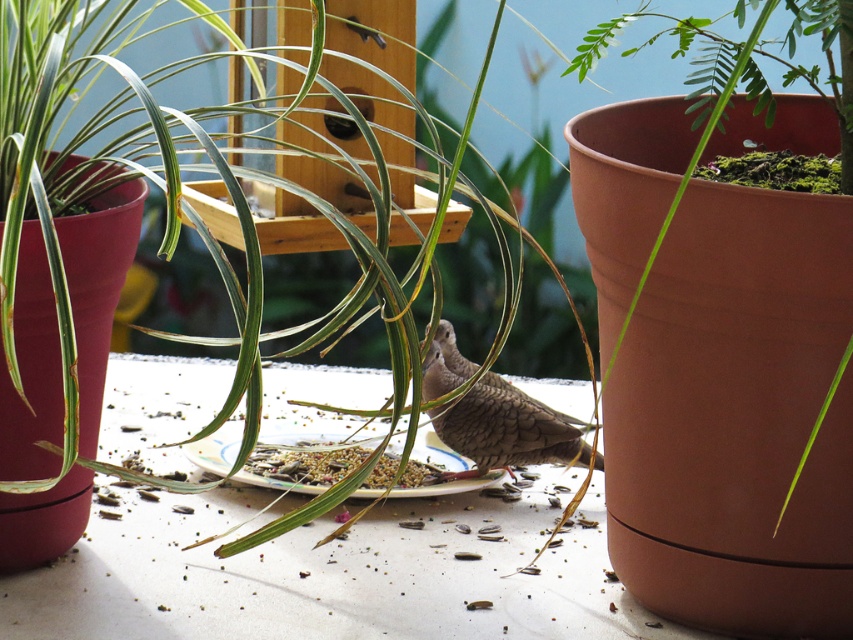
Is the position of green leafy plant at center more distant than that of brown textured seeds at center?

No, green leafy plant at center is closer to the viewer.

Is point (77, 324) positioned in front of point (328, 458)?

That is True.

Is point (57, 512) farther from camera compared to point (308, 444)?

No, (57, 512) is in front of (308, 444).

You are a GUI agent. You are given a task and a screenshot of the screen. Output one action in this format:
    pyautogui.click(x=<x>, y=<y>)
    Task: Click on the green leafy plant at center
    
    Given the screenshot: What is the action you would take?
    pyautogui.click(x=39, y=522)

Who is more forward, (x=26, y=502) or (x=471, y=440)?

Positioned in front is point (x=26, y=502).

Between point (20, 342) and point (552, 428), which one is positioned behind?

Positioned behind is point (552, 428).

Is point (337, 26) positioned after point (497, 422)?

Yes, it is behind point (497, 422).

The height and width of the screenshot is (640, 853). Find the location of `green leafy plant at center`. green leafy plant at center is located at coordinates (39, 522).

Does point (480, 449) lie behind point (352, 452)?

No, (480, 449) is closer to viewer.

Between point (514, 451) and point (375, 474), which one is positioned in front?

Point (514, 451) is more forward.

Is point (434, 384) closer to camera compared to point (294, 456)?

Yes, point (434, 384) is in front of point (294, 456).

Locate an element on the screen. This screenshot has width=853, height=640. brown speckled bird at center is located at coordinates (506, 433).